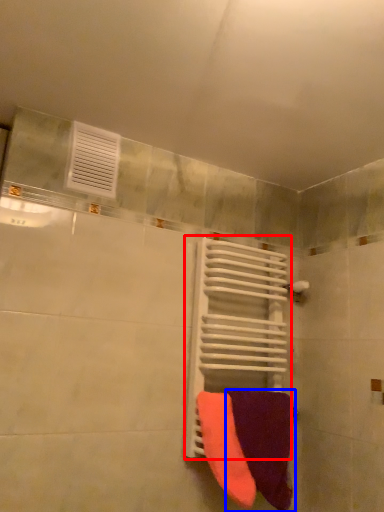
Question: Which object is further to the camera taking this photo, radiator (highlighted by a red box) or towel (highlighted by a blue box)?

Choices:
 (A) radiator
 (B) towel

Answer: (A)